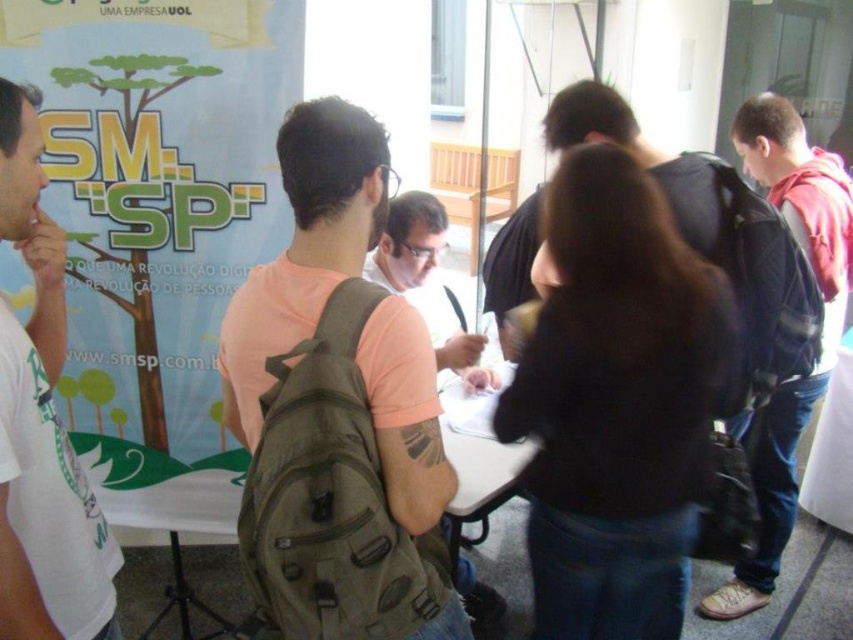
Question: Which point is closer to the camera?

Choices:
 (A) (306, 516)
 (B) (722, 609)
 (C) (28, 426)

Answer: (A)

Question: Does white t-shirt at left have a greater width compared to camouflage backpack at center?

Choices:
 (A) yes
 (B) no

Answer: (B)

Question: Is black matte backpack at center closer to the viewer compared to olive green canvas backpack at center?

Choices:
 (A) no
 (B) yes

Answer: (A)

Question: Which object is positioned farthest from the dark blue jeans at center?

Choices:
 (A) white t-shirt at left
 (B) black matte backpack at center
 (C) camouflage backpack at center
 (D) olive green canvas backpack at center

Answer: (A)

Question: Is black matte backpack at center above dark green backpack at right?

Choices:
 (A) yes
 (B) no

Answer: (B)

Question: Among these objects, which one is farthest from the camera?

Choices:
 (A) camouflage backpack at center
 (B) black matte backpack at center
 (C) olive green canvas backpack at center
 (D) white t-shirt at left

Answer: (A)